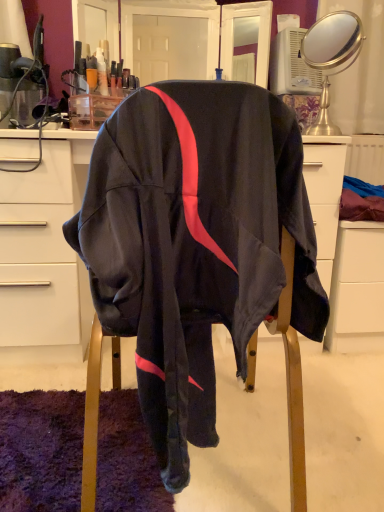
Question: Would you say matte white desk at center is outside white matte file cabinet at lower right?

Choices:
 (A) yes
 (B) no

Answer: (A)

Question: Is matte white desk at center looking in the opposite direction of white matte file cabinet at lower right?

Choices:
 (A) no
 (B) yes

Answer: (A)

Question: Are matte white desk at center and white matte file cabinet at lower right making contact?

Choices:
 (A) no
 (B) yes

Answer: (A)

Question: From the image's perspective, is matte white desk at center located above white matte file cabinet at lower right?

Choices:
 (A) yes
 (B) no

Answer: (A)

Question: Is matte white desk at center positioned far away from white matte file cabinet at lower right?

Choices:
 (A) no
 (B) yes

Answer: (A)

Question: Considering the relative sizes of matte white desk at center and white matte file cabinet at lower right in the image provided, is matte white desk at center taller than white matte file cabinet at lower right?

Choices:
 (A) no
 (B) yes

Answer: (B)

Question: From a real-world perspective, is white matte file cabinet at lower right located higher than matte white desk at center?

Choices:
 (A) yes
 (B) no

Answer: (B)

Question: From the image's perspective, is white matte file cabinet at lower right on matte white desk at center?

Choices:
 (A) yes
 (B) no

Answer: (B)

Question: From a real-world perspective, is white matte file cabinet at lower right under matte white desk at center?

Choices:
 (A) yes
 (B) no

Answer: (A)

Question: Does white matte file cabinet at lower right come in front of matte white desk at center?

Choices:
 (A) yes
 (B) no

Answer: (B)

Question: Is matte white desk at center surrounded by white matte file cabinet at lower right?

Choices:
 (A) yes
 (B) no

Answer: (B)

Question: Can you confirm if white matte file cabinet at lower right is positioned to the right of matte white desk at center?

Choices:
 (A) yes
 (B) no

Answer: (A)

Question: Is gold metallic mirror at upper right directly adjacent to matte white desk at center?

Choices:
 (A) no
 (B) yes

Answer: (A)